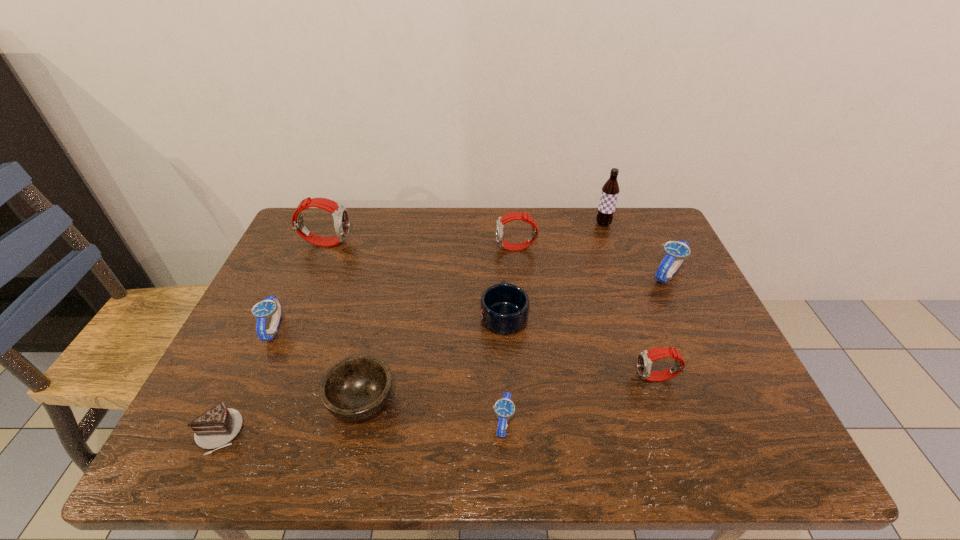
The image size is (960, 540). Identify the location of free space between the chocolate cake and the leftmost blue watch. (246, 381).

The image size is (960, 540). What are the coordinates of `vacant area that lies between the farthest blue watch and the root beer` in the screenshot? It's located at (636, 249).

You are a GUI agent. You are given a task and a screenshot of the screen. Output one action in this format:
    pyautogui.click(x=<x>, y=<y>)
    Task: Click on the vacant space in between the rightmost blue watch and the chocolate cake
    
    Given the screenshot: What is the action you would take?
    pyautogui.click(x=444, y=354)

Identify the location of vacant area between the rightmost watch and the chocolate cake. This screenshot has height=540, width=960. (444, 354).

Where is `free space between the chocolate cake and the third tallest object`? The image size is (960, 540). free space between the chocolate cake and the third tallest object is located at coordinates (367, 341).

Image resolution: width=960 pixels, height=540 pixels. I want to click on vacant point located between the brown root beer and the mug, so click(554, 269).

Where is `vacant area that lies between the mug and the bowl`? The width and height of the screenshot is (960, 540). vacant area that lies between the mug and the bowl is located at coordinates (433, 358).

I want to click on object that is the closest to the biggest red watch, so [270, 306].

This screenshot has height=540, width=960. What are the coordinates of `the ninth closest object to the bowl` in the screenshot? It's located at (610, 190).

Where is `watch that stands as the second closest to the nearest watch`? watch that stands as the second closest to the nearest watch is located at coordinates (502, 220).